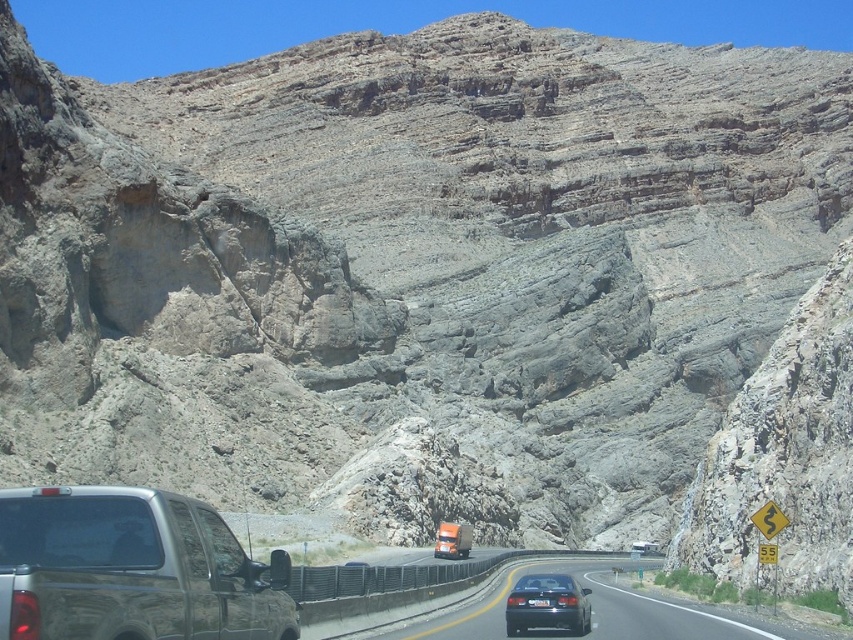
Between black asphalt road at center and black plastic license plate at center, which one has less height?

With less height is black plastic license plate at center.

Which is behind, point (485, 618) or point (537, 605)?

Positioned behind is point (485, 618).

Who is more distant from viewer, (592, 616) or (527, 602)?

Point (592, 616)

What are the coordinates of `black asphalt road at center` in the screenshot? It's located at (592, 616).

Does metallic gray truck at left have a greater height compared to shiny black sedan at center?

Correct, metallic gray truck at left is much taller as shiny black sedan at center.

Is metallic gray truck at left closer to the viewer compared to shiny black sedan at center?

Yes, metallic gray truck at left is closer to the viewer.

Does point (175, 563) come behind point (556, 595)?

No.

This screenshot has width=853, height=640. In order to click on metallic gray truck at left in this screenshot , I will do click(x=132, y=570).

Is point (73, 625) positioned behind point (543, 605)?

No, it is not.

Between metallic gray truck at left and black plastic license plate at center, which one has less height?

With less height is black plastic license plate at center.

Who is more forward, (125, 636) or (546, 605)?

Point (125, 636) is in front.

Where is `metallic gray truck at left`? The image size is (853, 640). metallic gray truck at left is located at coordinates (132, 570).